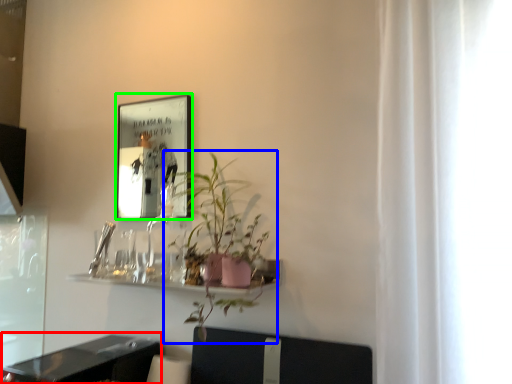
Question: Which object is positioned farthest from table (highlighted by a red box)? Select from houseplant (highlighted by a blue box) and picture frame (highlighted by a green box).

Choices:
 (A) houseplant
 (B) picture frame

Answer: (B)